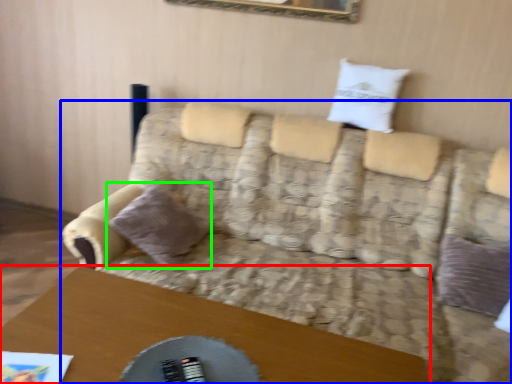
Question: Which object is positioned closest to table (highlighted by a red box)? Select from studio couch (highlighted by a blue box) and pillow (highlighted by a green box).

Choices:
 (A) studio couch
 (B) pillow

Answer: (B)